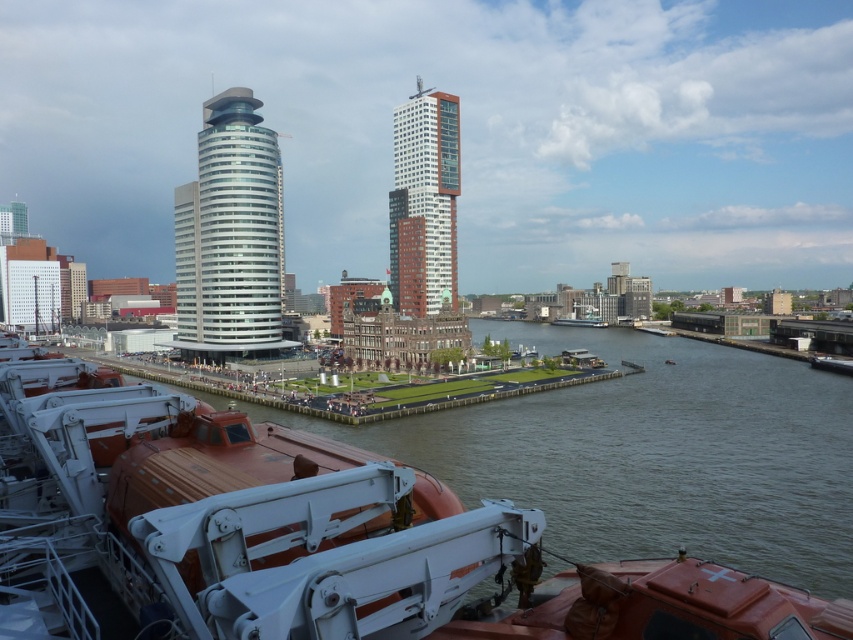
You are an architect analyzing the urban layout. From your vantage point on the ship, you notice the white glass tower at center and the red brick building at center. Which structure appears closer to you?

The white glass tower at center appears closer because it is positioned further to the viewer than the red brick building at center.

You are standing on the ship deck and want to compare the two buildings in the cityscape. Which of the following is wider between the white glass tower at center and the red brick building at center?

The white glass tower at center is wider than the red brick building at center according to the description.

You are an architect evaluating the city skyline. You see the white glass tower at center and the red brick building at center. Which one is shorter?

The white glass tower at center is shorter than the red brick building at center.